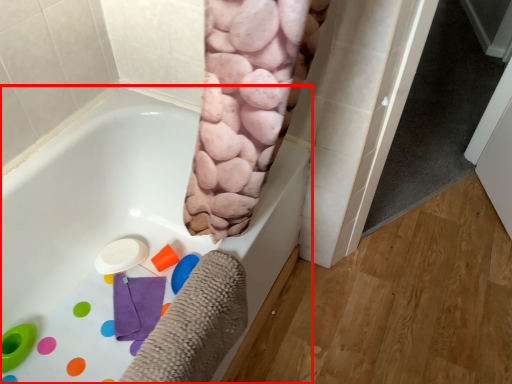
Question: From the image's perspective, considering the relative positions of bathtub (annotated by the red box) and screen door in the image provided, where is bathtub (annotated by the red box) located with respect to the staircase?

Choices:
 (A) below
 (B) above

Answer: (A)